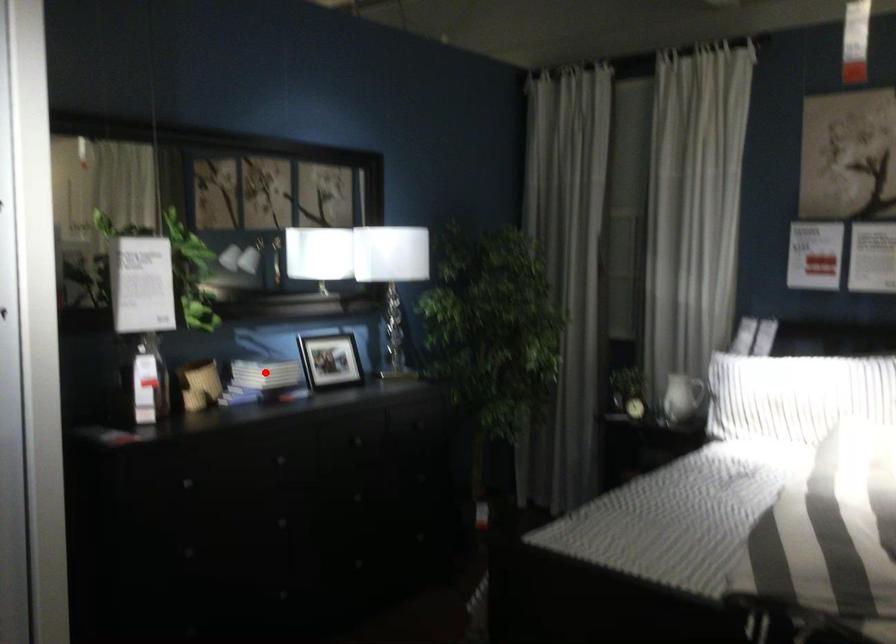
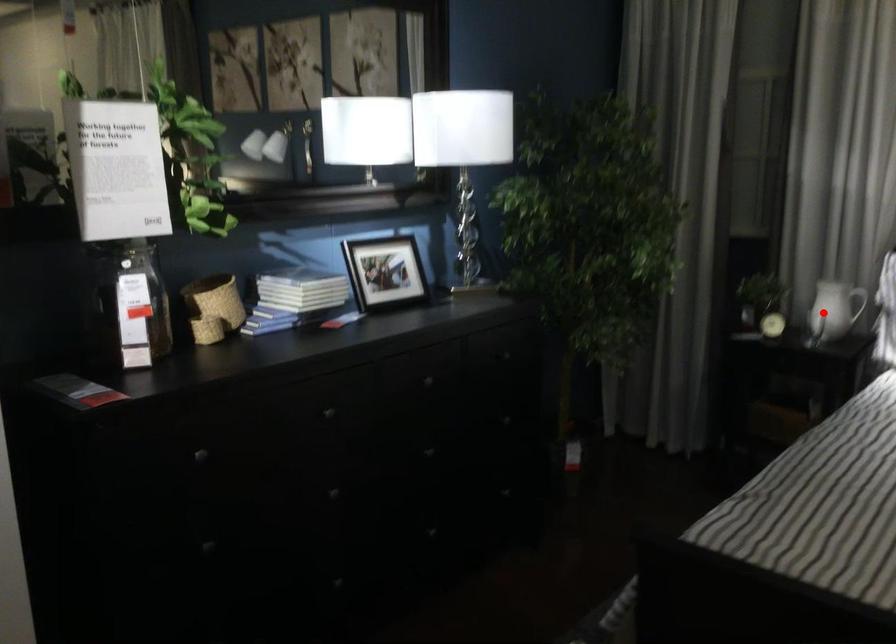
I am providing you with two images of the same scene from different viewpoints. A red point is marked on the first image and another point is marked on the second image. Is the red point in image1 aligned with the point shown in image2?

No